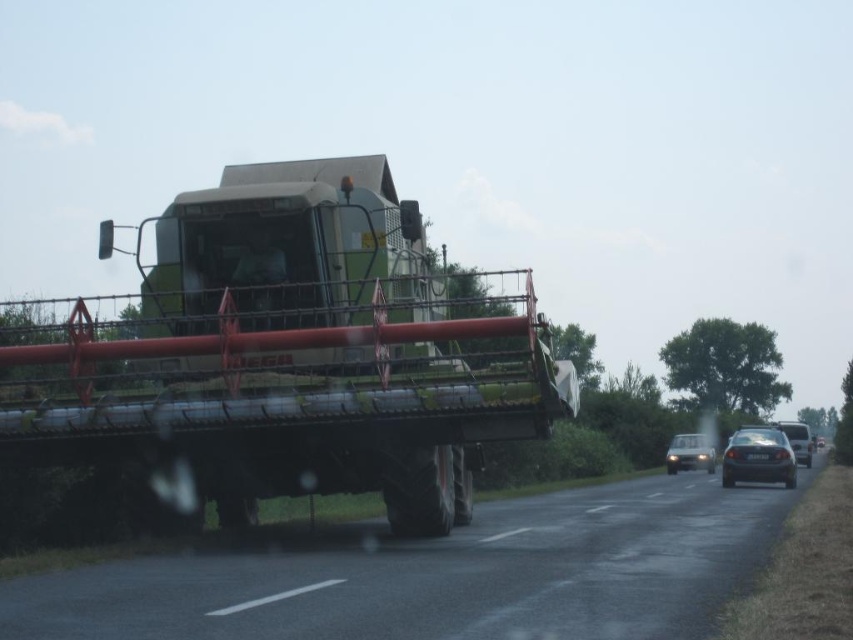
You are a delivery driver trying to pass a green matte trailer truck at center on a rural road. The truck is at point 0.558, 0.338. The road is narrow. Can you safely pass the truck without crossing the center line?

The green matte trailer truck at center is located at point (x=287, y=356), but without knowing the road width or the distance to oncoming traffic, it is impossible to determine if passing safely without crossing the center line is possible.